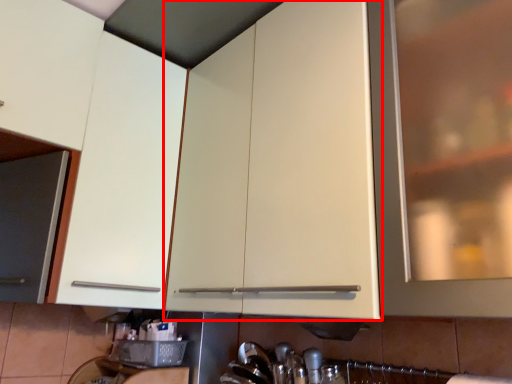
Question: From the image's perspective, where is cabinetry (annotated by the red box) located relative to cabinetry?

Choices:
 (A) above
 (B) below

Answer: (A)